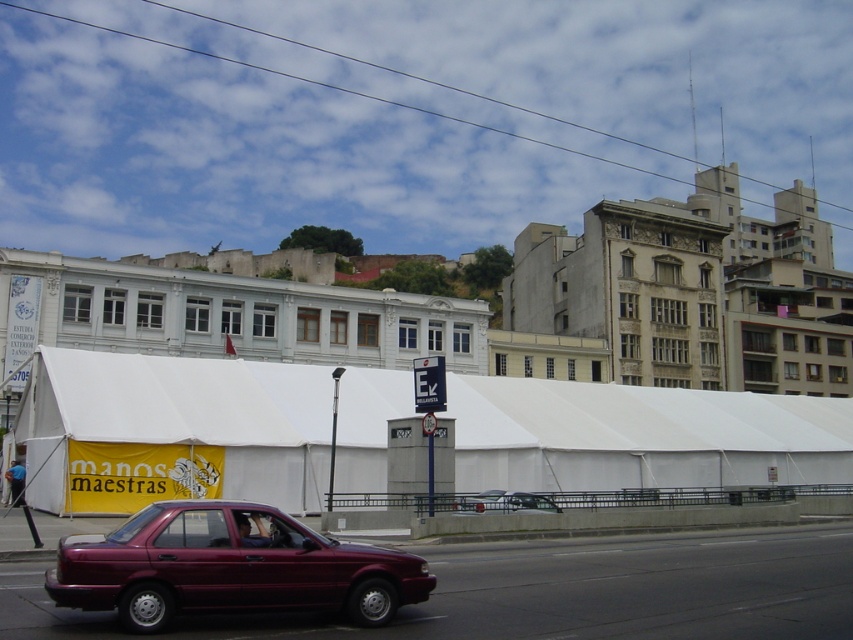
Can you confirm if white fabric tent at center is bigger than maroon metallic sedan at lower left?

Yes.

Is white fabric tent at center further to camera compared to maroon metallic sedan at lower left?

Yes, it is behind maroon metallic sedan at lower left.

Is point (717, 451) closer to camera compared to point (142, 557)?

No.

Identify the location of white fabric tent at center. (640, 436).

Can you confirm if maroon metallic sedan at lower left is positioned to the left of metallic silver sedan at center?

Indeed, maroon metallic sedan at lower left is positioned on the left side of metallic silver sedan at center.

How distant is maroon metallic sedan at lower left from metallic silver sedan at center?

The distance of maroon metallic sedan at lower left from metallic silver sedan at center is 16.60 meters.

Is point (161, 554) in front of point (527, 493)?

Yes, point (161, 554) is closer to viewer.

The height and width of the screenshot is (640, 853). In order to click on maroon metallic sedan at lower left in this screenshot , I will do `click(229, 566)`.

Who is more forward, (x=473, y=472) or (x=509, y=493)?

Point (x=509, y=493) is more forward.

Between white fabric tent at center and metallic silver sedan at center, which one has less height?

Standing shorter between the two is metallic silver sedan at center.

Identify the location of white fabric tent at center. (640, 436).